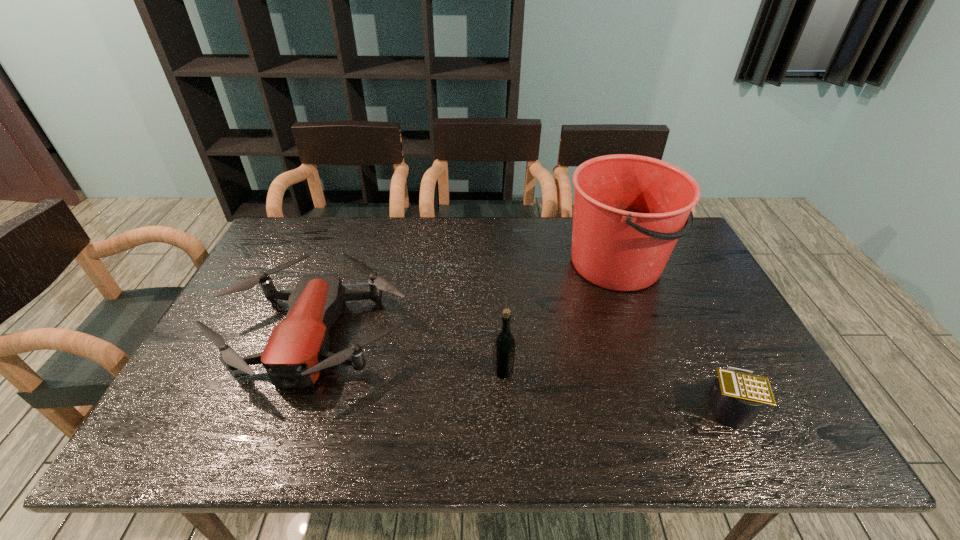
Find the location of `the tallest object`. the tallest object is located at coordinates (629, 211).

You are a GUI agent. You are given a task and a screenshot of the screen. Output one action in this format:
    pyautogui.click(x=<x>, y=<y>)
    Task: Click on the second object from left to right
    The image size is (960, 540).
    Given the screenshot: What is the action you would take?
    pyautogui.click(x=504, y=346)

I want to click on the third shortest object, so click(x=504, y=346).

The image size is (960, 540). In order to click on the leftmost object in this screenshot , I will do `click(297, 350)`.

Where is `calculator`? The height and width of the screenshot is (540, 960). calculator is located at coordinates (738, 396).

Where is `free space located on the left of the bucket`? This screenshot has width=960, height=540. free space located on the left of the bucket is located at coordinates (435, 265).

You are a GUI agent. You are given a task and a screenshot of the screen. Output one action in this format:
    pyautogui.click(x=<x>, y=<y>)
    Task: Click on the free space located on the right of the beer bottle
    
    Given the screenshot: What is the action you would take?
    click(x=559, y=371)

The image size is (960, 540). Identify the location of vacant space located 0.050m on the front-facing side of the leftmost object. (282, 421).

Image resolution: width=960 pixels, height=540 pixels. In order to click on free region located 0.200m on the left of the calculator in this screenshot , I will do 613,406.

At what (x,y) coordinates should I click in order to perform the action: click on object that is at the far edge. Please return your answer as a coordinate pair (x, y). Looking at the image, I should click on (629, 211).